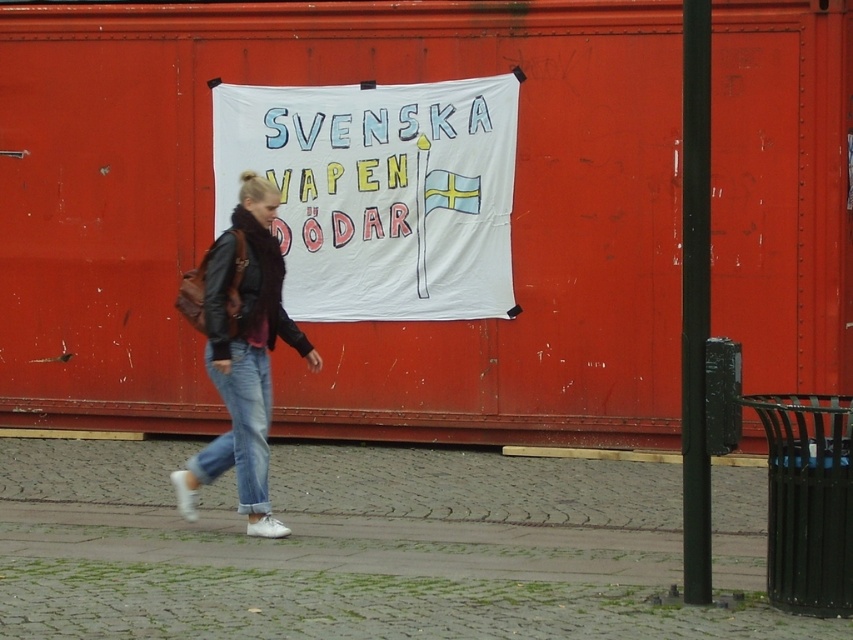
Which is behind, point (444, 172) or point (234, 428)?

The point (444, 172) is behind.

Is white fabric banner at center to the left of denim jeans at center from the viewer's perspective?

In fact, white fabric banner at center is to the right of denim jeans at center.

At what (x,y) coordinates should I click in order to perform the action: click on white fabric banner at center. Please return your answer as a coordinate pair (x, y). Looking at the image, I should click on (380, 193).

Find the location of a particular element. Image resolution: width=853 pixels, height=640 pixels. white fabric banner at center is located at coordinates (380, 193).

Between denim jeans at center and blue denim jeans at lower center, which one appears on the right side from the viewer's perspective?

Positioned to the right is denim jeans at center.

Is denim jeans at center to the left of blue denim jeans at lower center from the viewer's perspective?

No, denim jeans at center is not to the left of blue denim jeans at lower center.

Who is more distant from viewer, (247, 237) or (264, 484)?

Point (264, 484)

Locate an element on the screen. denim jeans at center is located at coordinates (241, 352).

Which is behind, point (440, 145) or point (267, 452)?

Positioned behind is point (440, 145).

Is point (509, 269) farther from viewer compared to point (235, 365)?

Yes, point (509, 269) is behind point (235, 365).

Where is `white fabric banner at center`? The height and width of the screenshot is (640, 853). white fabric banner at center is located at coordinates (380, 193).